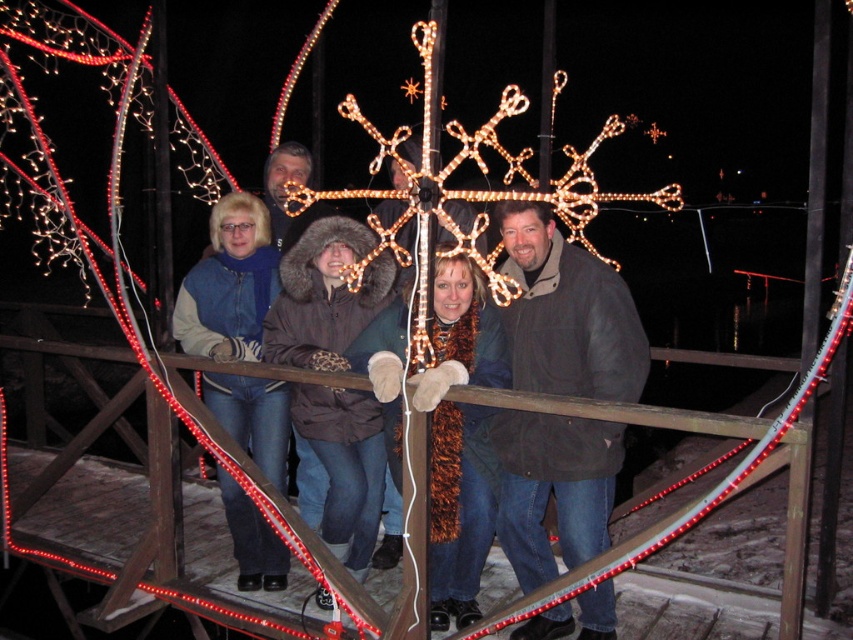
What are the coordinates of `dark brown jacket at center` in the screenshot? It's located at (567, 314).

Between point (573, 417) and point (363, 524), which one is positioned behind?

The point (363, 524) is more distant.

Where is `dark brown jacket at center`? The height and width of the screenshot is (640, 853). dark brown jacket at center is located at coordinates (567, 314).

Is fuzzy brown scarf at center further to the viewer compared to denim jacket at center?

No.

Is fuzzy brown scarf at center bigger than denim jacket at center?

Yes, fuzzy brown scarf at center is bigger than denim jacket at center.

Does point (444, 508) come farther from viewer compared to point (260, 227)?

No, (444, 508) is closer to viewer.

The height and width of the screenshot is (640, 853). I want to click on fuzzy brown scarf at center, so click(x=459, y=440).

At what (x,y) coordinates should I click in order to perform the action: click on dark brown jacket at center. Please return your answer as a coordinate pair (x, y). The height and width of the screenshot is (640, 853). Looking at the image, I should click on (567, 314).

Does dark brown jacket at center have a greater width compared to denim jacket at center?

Indeed, dark brown jacket at center has a greater width compared to denim jacket at center.

Identify the location of dark brown jacket at center. (567, 314).